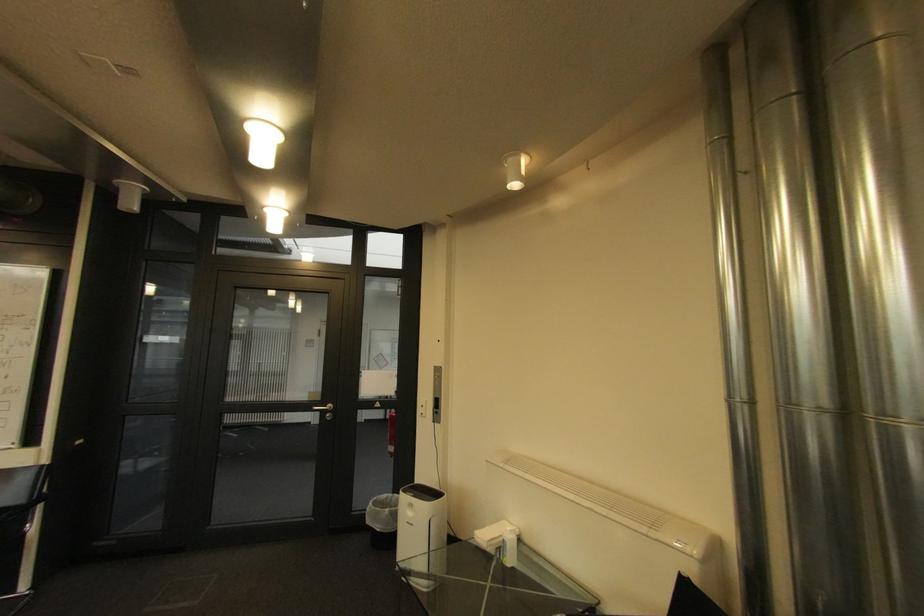
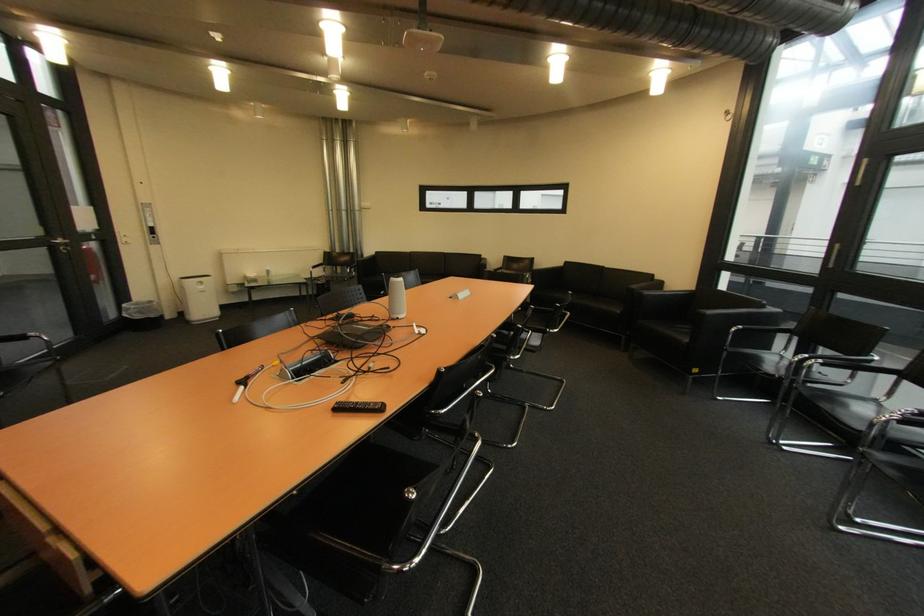
Locate, in the second image, the point that corresponds to point (337, 407) in the first image.

(68, 241)